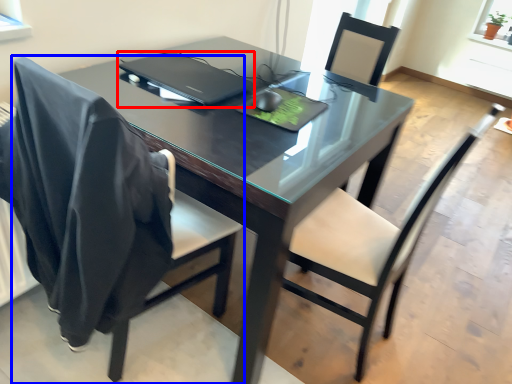
Question: Which of the following is the farthest to the observer, laptop (highlighted by a red box) or chair (highlighted by a blue box)?

Choices:
 (A) laptop
 (B) chair

Answer: (A)